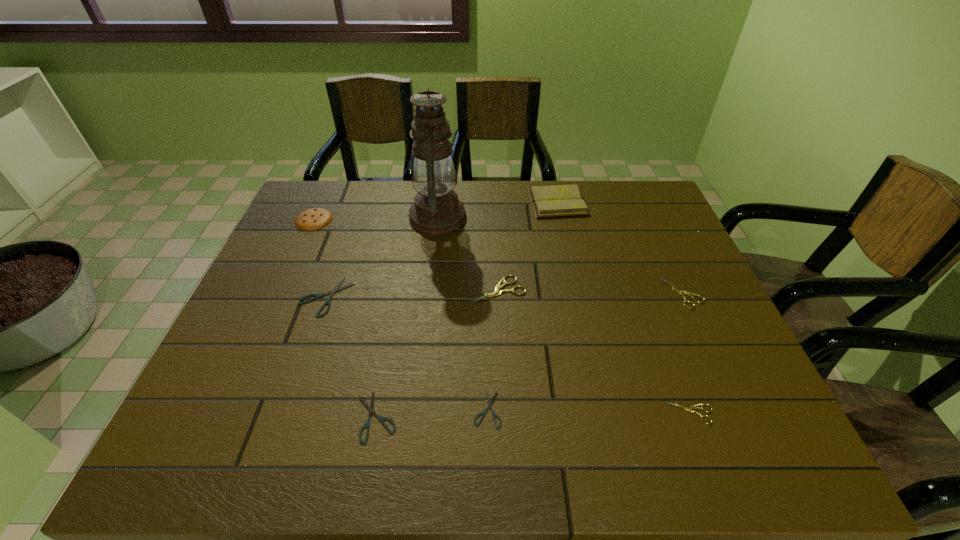
Image resolution: width=960 pixels, height=540 pixels. In order to click on free space located on the left of the rightmost object in this screenshot , I will do `click(620, 293)`.

Locate an element on the screen. The image size is (960, 540). vacant region located on the front of the farthest black shears is located at coordinates (274, 451).

Locate an element on the screen. vacant area situated 0.070m on the front of the second beige shears from right to left is located at coordinates (708, 459).

Locate an element on the screen. vacant space situated 0.200m on the right of the second black shears from left to right is located at coordinates (x=495, y=416).

Find the location of a particular element. free point located on the right of the smallest black shears is located at coordinates (607, 409).

Locate an element on the screen. The image size is (960, 540). oil lamp positioned at the far edge is located at coordinates (437, 210).

Identify the location of diary at the far edge. This screenshot has height=540, width=960. (552, 201).

Identify the location of cookie situated at the far edge. (312, 219).

Identify the location of cookie located at the left edge. (312, 219).

At what (x,y) coordinates should I click in order to perform the action: click on shears positioned at the left edge. Please return your answer as a coordinate pair (x, y). Looking at the image, I should click on (335, 289).